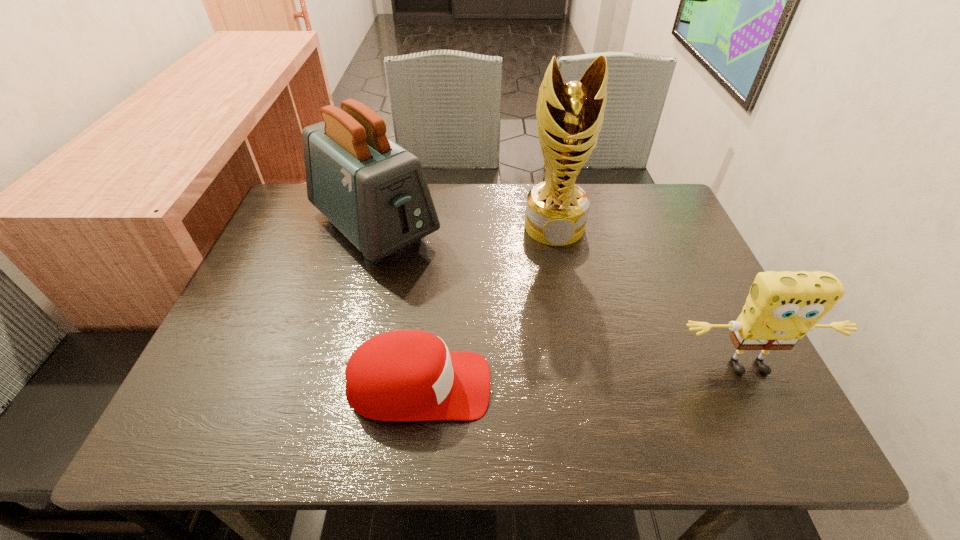
The height and width of the screenshot is (540, 960). Identify the location of free space on the desktop that is between the baseball cap and the third tallest object and is positioned on the front-facing side of the third object from left to right. (579, 378).

This screenshot has width=960, height=540. Find the location of `free spot on the desktop that is between the shortest object and the rightmost object and is positioned on the front-facing side of the second tallest object`. free spot on the desktop that is between the shortest object and the rightmost object and is positioned on the front-facing side of the second tallest object is located at coordinates 545,380.